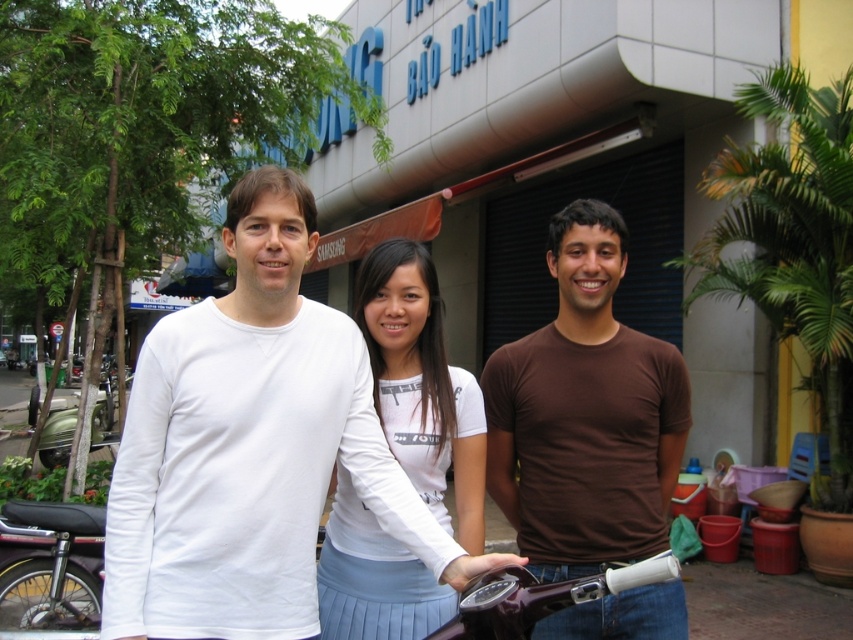
You are standing in front of the Samsung building and see the point marked at coordinates (251, 448). What object does this point correspond to?

The point at coordinates (251, 448) corresponds to the white matte shirt at center.